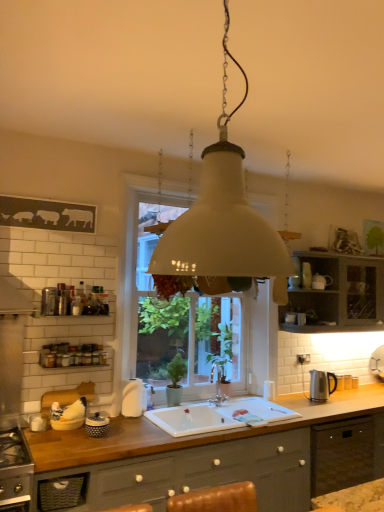
This screenshot has height=512, width=384. Find the location of `matte gray cabinet at upper right`. matte gray cabinet at upper right is located at coordinates (338, 294).

Image resolution: width=384 pixels, height=512 pixels. Identify the location of satin nickel kettle at right, marked as the third appliance in a front-to-back arrangement. (321, 385).

Find the location of a particular element. This screenshot has height=512, width=384. polka dot ceramic jar at lower left, which ranks as the 3th appliance in back-to-front order is located at coordinates (96, 425).

In order to face silver metallic faucet at sink center, should I rotate leftwards or rightwards?

A 3.731 degree turn to the right will do.

You are a GUI agent. You are given a task and a screenshot of the screen. Output one action in this format:
    pyautogui.click(x=<x>, y=<y>)
    Task: Click on the matte gray cabinet at upper right
    This screenshot has height=512, width=384.
    Given the screenshot: What is the action you would take?
    pyautogui.click(x=338, y=294)

In the image, is polka dot ceramic jar at lower left, the first appliance viewed from the left, positioned in front of or behind silver metallic faucet at sink center?

Clearly, polka dot ceramic jar at lower left, the first appliance viewed from the left, is in front of silver metallic faucet at sink center.

Is polka dot ceramic jar at lower left, the first appliance viewed from the left, spatially inside silver metallic faucet at sink center, or outside of it?

polka dot ceramic jar at lower left, the first appliance viewed from the left, cannot be found inside silver metallic faucet at sink center.

Does polka dot ceramic jar at lower left, which ranks as the 3th appliance in back-to-front order, have a larger size compared to silver metallic faucet at sink center?

Actually, polka dot ceramic jar at lower left, which ranks as the 3th appliance in back-to-front order, might be smaller than silver metallic faucet at sink center.

From a real-world perspective, is polka dot ceramic jar at lower left, the first appliance viewed from the left, positioned under silver metallic faucet at sink center based on gravity?

Yes, from a real-world perspective, polka dot ceramic jar at lower left, the first appliance viewed from the left, is below silver metallic faucet at sink center.

From the image's perspective, is wooden at lower center located beneath matte gray cabinet at upper right?

Yes, from the image's perspective, wooden at lower center is beneath matte gray cabinet at upper right.

Considering the relative sizes of wooden at lower center and matte gray cabinet at upper right in the image provided, is wooden at lower center shorter than matte gray cabinet at upper right?

No, wooden at lower center is not shorter than matte gray cabinet at upper right.

Is wooden at lower center in front of or behind matte gray cabinet at upper right in the image?

Visually, wooden at lower center is located in front of matte gray cabinet at upper right.

Considering the positions of objects wooden at lower center and matte gray cabinet at upper right in the image provided, who is more to the right, wooden at lower center or matte gray cabinet at upper right?

matte gray cabinet at upper right.

From the image's perspective, count 2nd appliances upward from the satin nickel kettle at right, which is the first appliance in right-to-left order, and point to it. Please provide its 2D coordinates.

[(133, 398)]

Is satin nickel kettle at right, which is the first appliance in right-to-left order, positioned with its back to white matte soap dispenser at center, the second appliance positioned from the front?

No, white matte soap dispenser at center, the second appliance positioned from the front, is not at the back of satin nickel kettle at right, which is the first appliance in right-to-left order.

Is satin nickel kettle at right, marked as the third appliance in a front-to-back arrangement, far from white matte soap dispenser at center, the second appliance positioned from the front?

satin nickel kettle at right, marked as the third appliance in a front-to-back arrangement, is far away from white matte soap dispenser at center, the second appliance positioned from the front.

From the picture: Is satin nickel kettle at right, marked as the third appliance in a front-to-back arrangement, taller than white matte soap dispenser at center, the 2th appliance positioned from the right?

Incorrect, the height of satin nickel kettle at right, marked as the third appliance in a front-to-back arrangement, is not larger of that of white matte soap dispenser at center, the 2th appliance positioned from the right.

Between white matte pendant light at center and satin nickel kettle at right, marked as the third appliance in a front-to-back arrangement, which one has larger size?

white matte pendant light at center.

Considering the relative sizes of white matte pendant light at center and satin nickel kettle at right, which is the first appliance in right-to-left order, in the image provided, is white matte pendant light at center shorter than satin nickel kettle at right, which is the first appliance in right-to-left order,?

No.

Is white matte pendant light at center thinner than satin nickel kettle at right, arranged as the 3th appliance when viewed from the left?

No, white matte pendant light at center is not thinner than satin nickel kettle at right, arranged as the 3th appliance when viewed from the left.

Does point (138, 381) appear closer or farther from the camera than point (291, 414)?

Point (138, 381) is positioned farther from the camera compared to point (291, 414).

Is white ceramic sink at center taller than white matte soap dispenser at center, the 2th appliance positioned from the right?

No.

Which point is more distant from viewer, (174, 425) or (139, 410)?

Positioned behind is point (139, 410).

Is white ceramic sink at center next to white matte soap dispenser at center, the second appliance positioned from the front, and touching it?

No, white ceramic sink at center is not in contact with white matte soap dispenser at center, the second appliance positioned from the front.

From the image's perspective, is white ceramic sink at center on white matte soap dispenser at center, the 2th appliance positioned from the right?

No.

Is white ceramic sink at center far from white glass window at center?

No, white ceramic sink at center is not far from white glass window at center.

Looking at this image, from a real-world perspective, is white ceramic sink at center over white glass window at center?

Actually, white ceramic sink at center is physically below white glass window at center in the real world.

Considering the sizes of objects white ceramic sink at center and white glass window at center in the image provided, who is bigger, white ceramic sink at center or white glass window at center?

white glass window at center.

Which is in front, white ceramic sink at center or white glass window at center?

white ceramic sink at center.

Which appliance is the 2nd one when counting from the front of the silver metallic faucet at sink center? Please provide its 2D coordinates.

[(96, 425)]

This screenshot has height=512, width=384. Find the location of `cabinetry on the right of wooden at lower center`. cabinetry on the right of wooden at lower center is located at coordinates click(338, 294).

Considering their positions, is satin nickel kettle at right, which is the 1th appliance from back to front, positioned closer to silver metallic faucet at sink center than matte gray cabinet at upper right?

Among the two, satin nickel kettle at right, which is the 1th appliance from back to front, is located nearer to silver metallic faucet at sink center.

Which object lies nearer to the anchor point satin nickel kettle at right, which is the 1th appliance from back to front, wooden at lower center or white ceramic sink at center?

white ceramic sink at center is closer to satin nickel kettle at right, which is the 1th appliance from back to front.

Based on their spatial positions, is polka dot ceramic jar at lower left, which ranks as the 3th appliance in back-to-front order, or satin nickel kettle at right, arranged as the 3th appliance when viewed from the left, further from white glass window at center?

polka dot ceramic jar at lower left, which ranks as the 3th appliance in back-to-front order.

Looking at the image, which one is located closer to satin nickel kettle at right, which is the 1th appliance from back to front, matte gray cabinet at upper right or white ceramic sink at center?

Among the two, matte gray cabinet at upper right is located nearer to satin nickel kettle at right, which is the 1th appliance from back to front.

Which object lies nearer to the anchor point satin nickel kettle at right, which is the 1th appliance from back to front, matte gray cabinet at upper right or wooden at lower center?

matte gray cabinet at upper right is closer to satin nickel kettle at right, which is the 1th appliance from back to front.

When comparing their distances from matte gray cabinet at upper right, does wooden at lower center or satin nickel kettle at right, marked as the third appliance in a front-to-back arrangement, seem further?

Among the two, wooden at lower center is located further to matte gray cabinet at upper right.

Estimate the real-world distances between objects in this image. Which object is further from white matte soap dispenser at center, the 2th appliance positioned from the right, white matte pendant light at center or silver metallic faucet at sink center?

white matte pendant light at center.

Looking at this image, estimate the real-world distances between objects in this image. Which object is closer to polka dot ceramic jar at lower left, positioned as the third appliance in right-to-left order, white ceramic sink at center or white glass window at center?

The object closer to polka dot ceramic jar at lower left, positioned as the third appliance in right-to-left order, is white ceramic sink at center.

At what (x,y) coordinates should I click in order to perform the action: click on sink between white matte pendant light at center and wooden at lower center in the up-down direction. Please return your answer as a coordinate pair (x, y). Looking at the image, I should click on (219, 416).

This screenshot has height=512, width=384. Find the location of `countertop located between white matte pendant light at center and white matte soap dispenser at center, the second appliance positioned from the front, in the depth direction`. countertop located between white matte pendant light at center and white matte soap dispenser at center, the second appliance positioned from the front, in the depth direction is located at coordinates (191, 453).

Where is `sink between white matte pendant light at center and white glass window at center along the z-axis`? Image resolution: width=384 pixels, height=512 pixels. sink between white matte pendant light at center and white glass window at center along the z-axis is located at coordinates (219, 416).

The height and width of the screenshot is (512, 384). I want to click on appliance located between polka dot ceramic jar at lower left, which ranks as the 3th appliance in back-to-front order, and white ceramic sink at center in the left-right direction, so pyautogui.click(x=133, y=398).